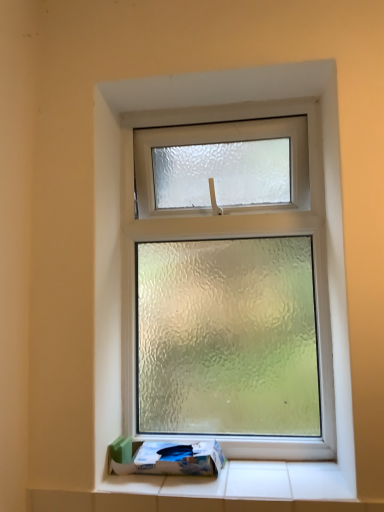
Question: Is white cardboard box at bottom wider or thinner than frosted glass window at center?

Choices:
 (A) thin
 (B) wide

Answer: (B)

Question: Is white cardboard box at bottom in front of or behind frosted glass window at center in the image?

Choices:
 (A) front
 (B) behind

Answer: (A)

Question: Is point (142, 459) positioned closer to the camera than point (107, 414)?

Choices:
 (A) closer
 (B) farther

Answer: (A)

Question: From a real-world perspective, is frosted glass window at center above or below white cardboard box at bottom?

Choices:
 (A) below
 (B) above

Answer: (B)

Question: Is frosted glass window at center taller or shorter than white cardboard box at bottom?

Choices:
 (A) short
 (B) tall

Answer: (B)

Question: Considering the positions of point (99, 152) and point (125, 466), is point (99, 152) closer or farther from the camera than point (125, 466)?

Choices:
 (A) farther
 (B) closer

Answer: (A)

Question: Do you think frosted glass window at center is within white cardboard box at bottom, or outside of it?

Choices:
 (A) inside
 (B) outside

Answer: (B)